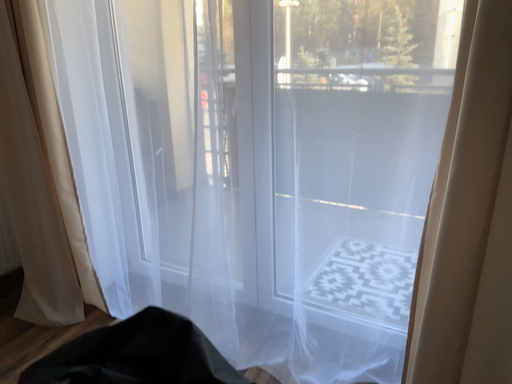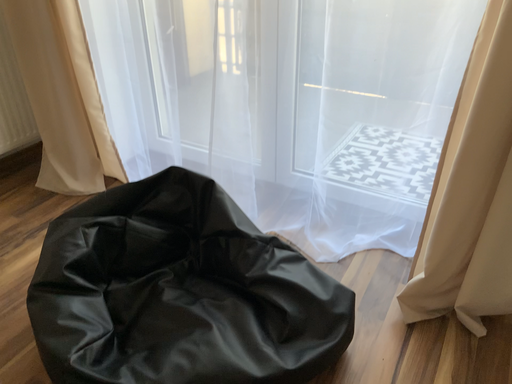
Question: Which way did the camera rotate in the video?

Choices:
 (A) rotated upward
 (B) rotated downward

Answer: (B)